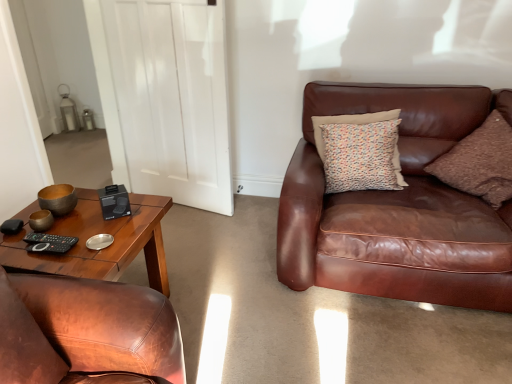
Identify the location of vacant point to the right of brown leather chair at left. This screenshot has width=512, height=384. (226, 312).